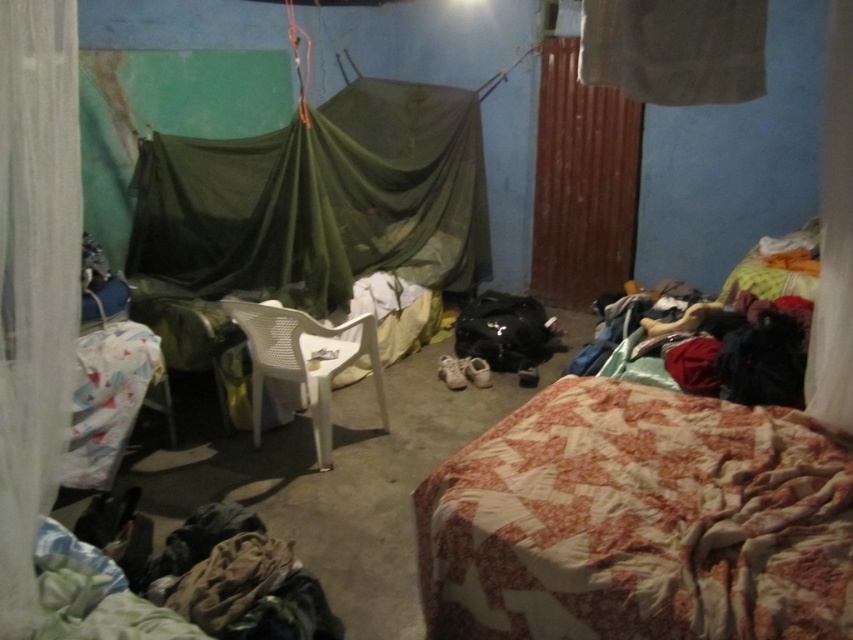
You are a delivery person who needs to place a 4.5 feet long package between the patchwork quilted bed at lower right and the white sheer curtain at left. Can the package fit in that space?

The distance between the patchwork quilted bed at lower right and the white sheer curtain at left is 4.32 feet, which is shorter than the 4.5 feet long package. Therefore, the package cannot fit between them.

From the picture: You are a delivery person entering the room and need to place a large box between the white sheer curtain at left and the white sheer curtain at upper center. Given that the box is 4 feet wide, will it fit in the space between them?

The distance between the white sheer curtain at left and the white sheer curtain at upper center is 4.57 feet. Since the box is 4 feet wide, it will fit as there is enough space.

Based on the scene description, where is the patchwork quilted bed at lower right located in terms of its 2D coordinates?

The patchwork quilted bed at lower right is located at the 2D coordinates of point (639, 522).